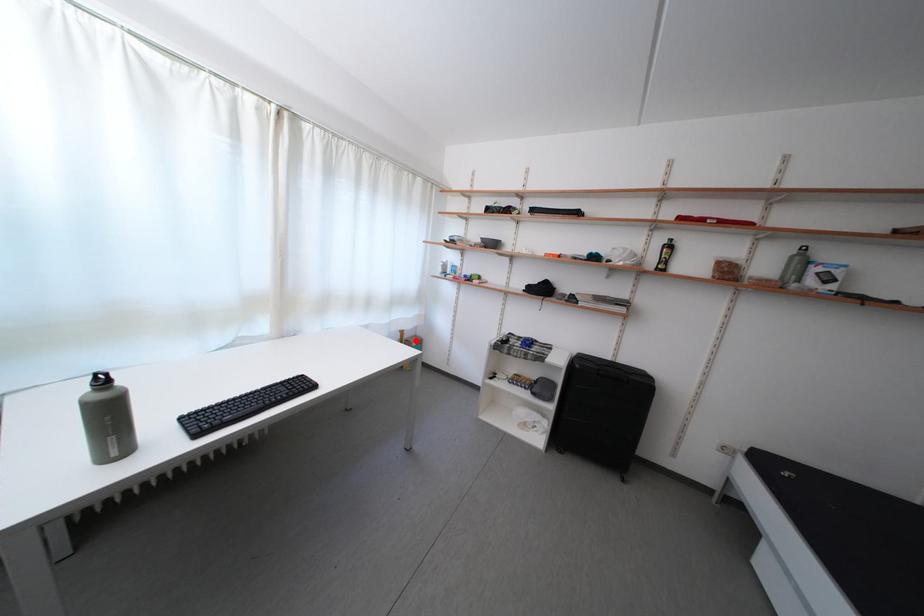
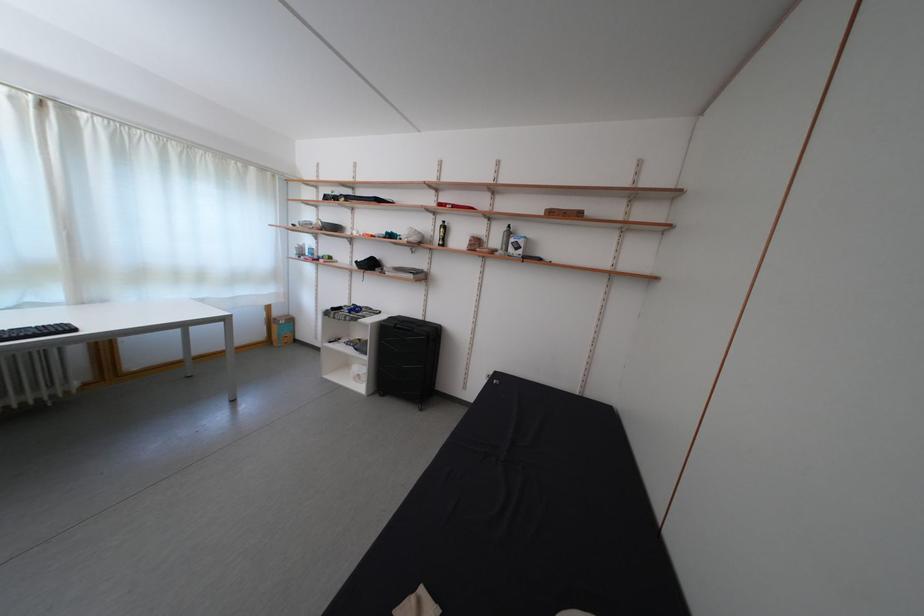
Question: I am providing you with two images of the same scene from different viewpoints. Given a red point in image1, look at the same physical point in image2. Is it:

Choices:
 (A) Closer to the viewpoint
 (B) Farther from the viewpoint

Answer: (B)